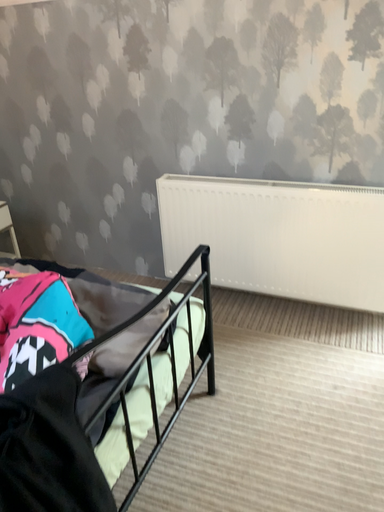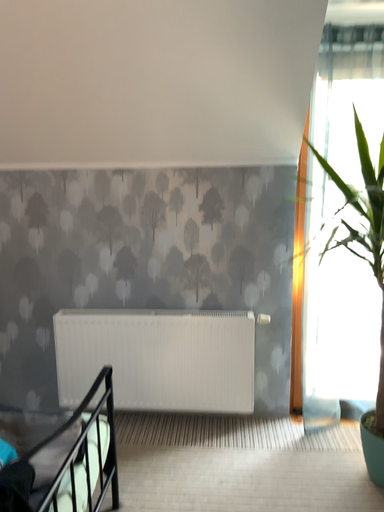
Question: How did the camera likely rotate when shooting the video?

Choices:
 (A) rotated left
 (B) rotated right

Answer: (B)